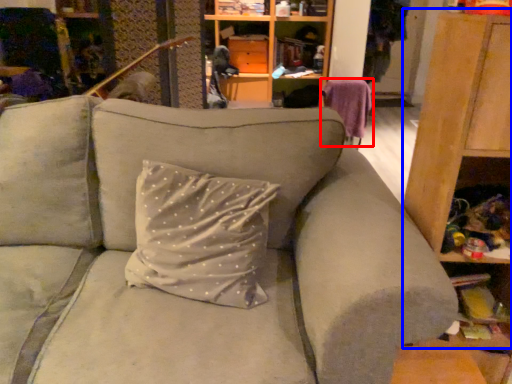
Question: Which point is further to the camera, swivel chair (highlighted by a red box) or dresser (highlighted by a blue box)?

Choices:
 (A) swivel chair
 (B) dresser

Answer: (A)